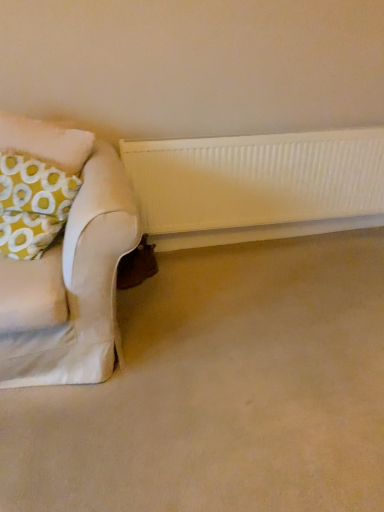
Question: Does white textured radiator at lower center have a smaller size compared to yellow fabric pillow at left?

Choices:
 (A) yes
 (B) no

Answer: (A)

Question: Considering the relative positions of white textured radiator at lower center and yellow fabric pillow at left in the image provided, is white textured radiator at lower center behind yellow fabric pillow at left?

Choices:
 (A) no
 (B) yes

Answer: (B)

Question: Considering the relative sizes of white textured radiator at lower center and yellow fabric pillow at left in the image provided, is white textured radiator at lower center wider than yellow fabric pillow at left?

Choices:
 (A) yes
 (B) no

Answer: (B)

Question: Does white textured radiator at lower center touch yellow fabric pillow at left?

Choices:
 (A) no
 (B) yes

Answer: (A)

Question: Does white textured radiator at lower center appear on the left side of yellow fabric pillow at left?

Choices:
 (A) no
 (B) yes

Answer: (A)

Question: Is point (261, 238) positioned closer to the camera than point (340, 371)?

Choices:
 (A) farther
 (B) closer

Answer: (A)

Question: Relative to beige carpet at lower center, is white textured radiator at lower center in front or behind?

Choices:
 (A) front
 (B) behind

Answer: (B)

Question: In terms of width, does white textured radiator at lower center look wider or thinner when compared to beige carpet at lower center?

Choices:
 (A) wide
 (B) thin

Answer: (B)

Question: Is white textured radiator at lower center taller or shorter than beige carpet at lower center?

Choices:
 (A) short
 (B) tall

Answer: (B)

Question: From the image's perspective, is yellow fabric pillow at left above or below white textured radiator at lower center?

Choices:
 (A) above
 (B) below

Answer: (A)

Question: In terms of size, does yellow fabric pillow at left appear bigger or smaller than white textured radiator at lower center?

Choices:
 (A) big
 (B) small

Answer: (A)

Question: Looking at their shapes, would you say yellow fabric pillow at left is wider or thinner than white textured radiator at lower center?

Choices:
 (A) wide
 (B) thin

Answer: (A)

Question: From a real-world perspective, is yellow fabric pillow at left physically located above or below white textured radiator at lower center?

Choices:
 (A) below
 (B) above

Answer: (B)

Question: In the image, is yellow fabric pillow at left on the left side or the right side of white ribbed radiator at center?

Choices:
 (A) right
 (B) left

Answer: (B)

Question: Based on their sizes in the image, would you say yellow fabric pillow at left is bigger or smaller than white ribbed radiator at center?

Choices:
 (A) small
 (B) big

Answer: (B)